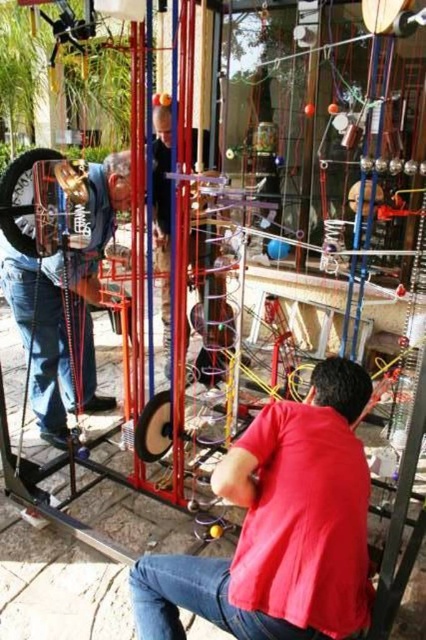
Who is lower down, red matte shirt at center or matte gold necklace at left?

red matte shirt at center is below.

From the picture: Is red matte shirt at center to the right of matte gold necklace at left from the viewer's perspective?

Indeed, red matte shirt at center is positioned on the right side of matte gold necklace at left.

Which is in front, point (155, 593) or point (83, 388)?

Point (155, 593) is more forward.

Find the location of a particular element. The width and height of the screenshot is (426, 640). red matte shirt at center is located at coordinates (281, 525).

Between blue denim jeans at lower left and matte black shirt at center, which one has less height?

blue denim jeans at lower left

The width and height of the screenshot is (426, 640). What do you see at coordinates (51, 360) in the screenshot?
I see `blue denim jeans at lower left` at bounding box center [51, 360].

This screenshot has height=640, width=426. Describe the element at coordinates (51, 360) in the screenshot. I see `blue denim jeans at lower left` at that location.

Find the location of a particular element. The image size is (426, 640). blue denim jeans at lower left is located at coordinates (51, 360).

Who is lower down, jeans at lower center or blue denim jeans at lower left?

jeans at lower center is below.

Who is positioned more to the right, jeans at lower center or blue denim jeans at lower left?

From the viewer's perspective, jeans at lower center appears more on the right side.

Image resolution: width=426 pixels, height=640 pixels. I want to click on jeans at lower center, so click(x=196, y=600).